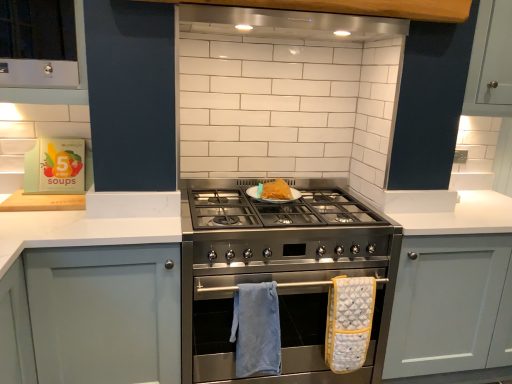
Question: From the image's perspective, is blue soft towel at lower center, the first bath towel from the left, located above or below matte gray cabinet at center, which is counted as the 1th cabinetry, starting from the right?

Choices:
 (A) above
 (B) below

Answer: (B)

Question: From a real-world perspective, is blue soft towel at lower center, which is the second bath towel from right to left, positioned above or below matte gray cabinet at center, which is counted as the 1th cabinetry, starting from the right?

Choices:
 (A) below
 (B) above

Answer: (B)

Question: Which is farther from the blue soft towel at lower center, which is the second bath towel from right to left?

Choices:
 (A) stainless steel exhaust hood at upper center
 (B) matte gray cabinet at center, which is counted as the 1th cabinetry, starting from the right
 (C) golden brown pastry at center
 (D) yellow quilted oven mitt at center, marked as the 1th bath towel in a right-to-left arrangement
 (E) white matte cabinet at left, which is the 1th cabinetry in left-to-right order

Answer: (A)

Question: Which object is positioned farthest from the white matte cabinet at left, which is the 1th cabinetry in left-to-right order?

Choices:
 (A) yellow quilted oven mitt at center, marked as the 1th bath towel in a right-to-left arrangement
 (B) blue soft towel at lower center, the first bath towel from the left
 (C) stainless steel stove at center
 (D) matte gray cabinet at center, marked as the 2th cabinetry in a left-to-right arrangement
 (E) golden brown pastry at center

Answer: (D)